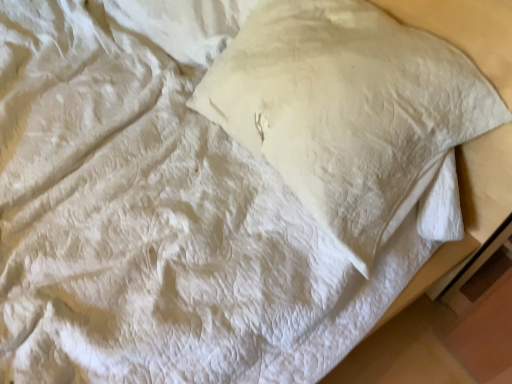
Where is `white quilted pillow at upper center`? Image resolution: width=512 pixels, height=384 pixels. white quilted pillow at upper center is located at coordinates (347, 110).

In order to face white quilted pillow at upper center, should I rotate leftwards or rightwards?

Turn right approximately 9.799 degrees to face it.

What do you see at coordinates (347, 110) in the screenshot?
I see `white quilted pillow at upper center` at bounding box center [347, 110].

At what (x,y) coordinates should I click in order to perform the action: click on white quilted pillow at upper center. Please return your answer as a coordinate pair (x, y). Looking at the image, I should click on (347, 110).